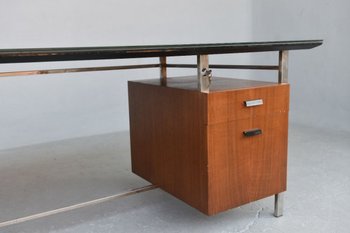
You are a GUI agent. You are given a task and a screenshot of the screen. Output one action in this format:
    pyautogui.click(x=<x>, y=<y>)
    Task: Click on the desk top
    Image resolution: width=350 pixels, height=233 pixels.
    Given the screenshot: What is the action you would take?
    pyautogui.click(x=164, y=50)